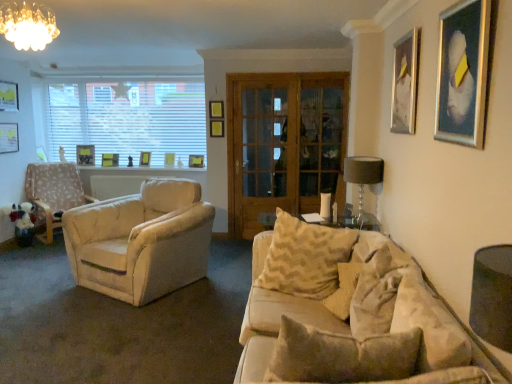
Question: Could you tell me if beige textured pillow at center, which ranks as the 3th pillow in front-to-back order, is facing metallic silver picture frame at upper right, which is the 1th picture frame from right to left?

Choices:
 (A) yes
 (B) no

Answer: (B)

Question: Would you say metallic silver picture frame at upper right, which is the 1th picture frame from right to left, is part of beige textured pillow at center, which ranks as the 3th pillow in front-to-back order,'s contents?

Choices:
 (A) no
 (B) yes

Answer: (A)

Question: Is beige textured pillow at center, the 1th pillow in the back-to-front sequence, facing away from metallic silver picture frame at upper right, acting as the second picture frame starting from the front?

Choices:
 (A) yes
 (B) no

Answer: (B)

Question: From a real-world perspective, does beige textured pillow at center, which ranks as the 3th pillow in front-to-back order, stand above metallic silver picture frame at upper right, which is the 1th picture frame from right to left?

Choices:
 (A) yes
 (B) no

Answer: (B)

Question: Considering the relative positions of beige textured pillow at center, the 1th pillow in the back-to-front sequence, and metallic silver picture frame at upper right, the ninth picture frame viewed from the left, in the image provided, is beige textured pillow at center, the 1th pillow in the back-to-front sequence, to the right of metallic silver picture frame at upper right, the ninth picture frame viewed from the left, from the viewer's perspective?

Choices:
 (A) no
 (B) yes

Answer: (A)

Question: Relative to matte yellow picture frame at upper center, which is the 6th picture frame in front-to-back order, is wooden glass door at center in front or behind?

Choices:
 (A) front
 (B) behind

Answer: (A)

Question: In terms of height, does wooden glass door at center look taller or shorter compared to matte yellow picture frame at upper center, which is the 6th picture frame in front-to-back order?

Choices:
 (A) short
 (B) tall

Answer: (B)

Question: Is point (345, 79) positioned closer to the camera than point (143, 155)?

Choices:
 (A) closer
 (B) farther

Answer: (A)

Question: From the image's perspective, is wooden glass door at center located above or below matte yellow picture frame at upper center, which ranks as the fourth picture frame in back-to-front order?

Choices:
 (A) below
 (B) above

Answer: (A)

Question: In terms of height, does textured beige pillow at center, which ranks as the second pillow in front-to-back order, look taller or shorter compared to matte gold chandelier at upper left?

Choices:
 (A) tall
 (B) short

Answer: (A)

Question: From the image's perspective, is textured beige pillow at center, which ranks as the second pillow in front-to-back order, positioned above or below matte gold chandelier at upper left?

Choices:
 (A) below
 (B) above

Answer: (A)

Question: Is point click(389, 254) positioned closer to the camera than point click(47, 11)?

Choices:
 (A) closer
 (B) farther

Answer: (B)

Question: In the image, is textured beige pillow at center, the 2th pillow positioned from the back, on the left side or the right side of matte gold chandelier at upper left?

Choices:
 (A) left
 (B) right

Answer: (B)

Question: Considering the positions of beige textured pillow at center, which ranks as the 3th pillow in front-to-back order, and matte black picture frame at upper left, which is the 1th picture frame in back-to-front order, in the image, is beige textured pillow at center, which ranks as the 3th pillow in front-to-back order, wider or thinner than matte black picture frame at upper left, which is the 1th picture frame in back-to-front order,?

Choices:
 (A) thin
 (B) wide

Answer: (B)

Question: Would you say beige textured pillow at center, which ranks as the 3th pillow in front-to-back order, is to the left or to the right of matte black picture frame at upper left, which is counted as the 9th picture frame, starting from the front, in the picture?

Choices:
 (A) right
 (B) left

Answer: (A)